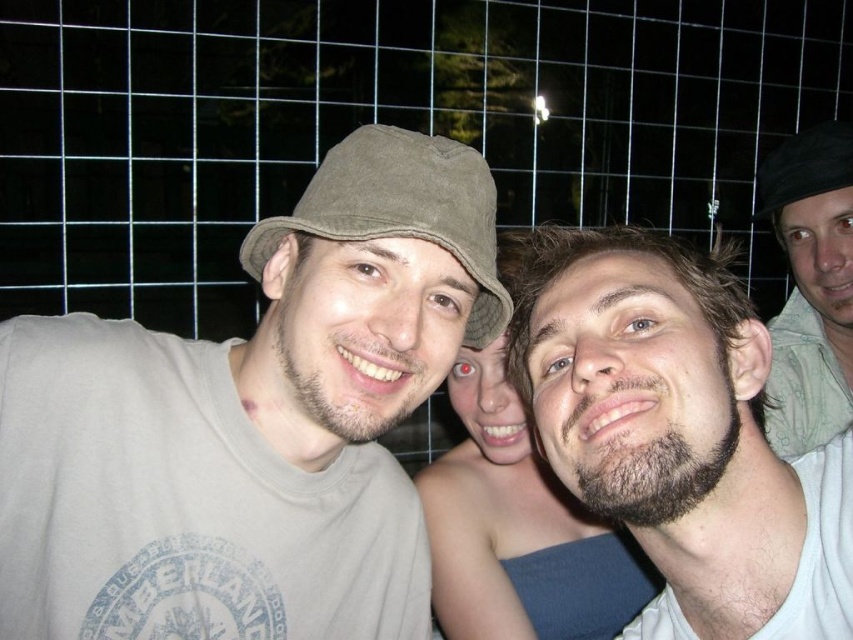
Question: Which object appears closest to the camera in this image?

Choices:
 (A) smooth skin at center
 (B) khaki fabric baseball cap at left
 (C) bearded man at center

Answer: (C)

Question: Which point appears farthest from the camera in this image?

Choices:
 (A) (125, 472)
 (B) (834, 124)

Answer: (B)

Question: Does matte khaki bucket hat at center appear on the left side of green fabric shirt at right?

Choices:
 (A) yes
 (B) no

Answer: (A)

Question: Can you confirm if matte khaki bucket hat at center is positioned to the right of khaki fabric baseball cap at left?

Choices:
 (A) no
 (B) yes

Answer: (A)

Question: Does khaki fabric baseball cap at left have a larger size compared to black fabric hat at upper right?

Choices:
 (A) no
 (B) yes

Answer: (B)

Question: Among these objects, which one is nearest to the camera?

Choices:
 (A) bearded man at center
 (B) smooth skin at center

Answer: (A)